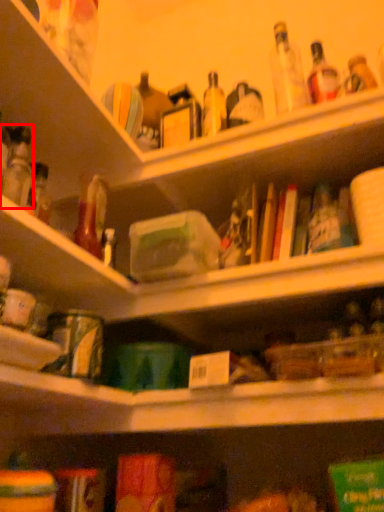
Question: From the image, what is the correct spatial relationship of bottle (annotated by the red box) in relation to shelf?

Choices:
 (A) left
 (B) right

Answer: (A)